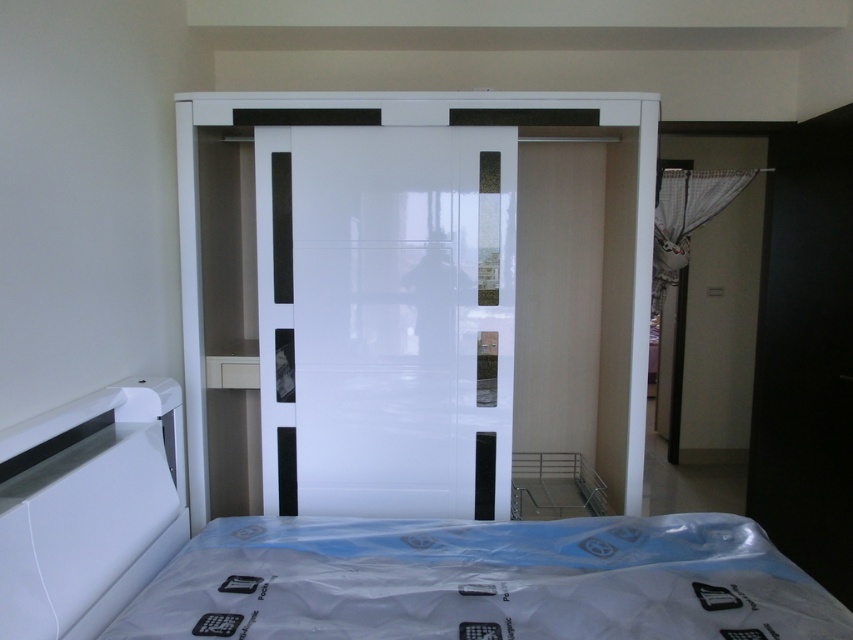
Does glossy white glass door at center appear under glossy white wardrobe at center?

Yes.

Does glossy white glass door at center have a lesser width compared to glossy white wardrobe at center?

Yes, glossy white glass door at center is thinner than glossy white wardrobe at center.

Is point (372, 248) closer to viewer compared to point (589, 99)?

No, (372, 248) is behind (589, 99).

Locate an element on the screen. The height and width of the screenshot is (640, 853). glossy white glass door at center is located at coordinates [387, 317].

Is white glossy bed at center to the right of glossy white wardrobe at center from the viewer's perspective?

Indeed, white glossy bed at center is positioned on the right side of glossy white wardrobe at center.

Does white glossy bed at center appear under glossy white wardrobe at center?

Yes.

Is point (608, 625) more distant than point (618, 394)?

No, it is not.

You are a GUI agent. You are given a task and a screenshot of the screen. Output one action in this format:
    pyautogui.click(x=<x>, y=<y>)
    Task: Click on the white glossy bed at center
    The image size is (853, 640).
    Given the screenshot: What is the action you would take?
    pyautogui.click(x=465, y=580)

Is white glossy bed at center taller than glossy white glass door at center?

In fact, white glossy bed at center may be shorter than glossy white glass door at center.

Between white glossy bed at center and glossy white glass door at center, which one has more height?

Standing taller between the two is glossy white glass door at center.

Locate an element on the screen. white glossy bed at center is located at coordinates (465, 580).

Locate an element on the screen. The width and height of the screenshot is (853, 640). white glossy bed at center is located at coordinates (465, 580).